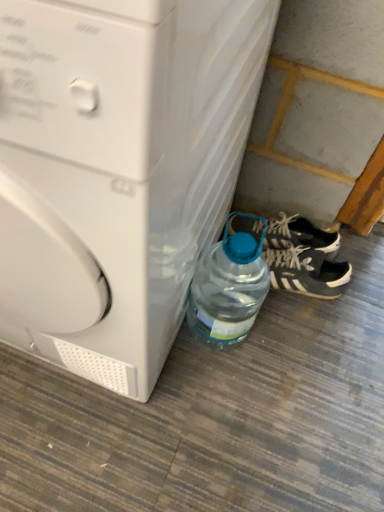
Question: Considering the relative positions of black suede sneakers at lower right and white plastic washing machine at lower left in the image provided, is black suede sneakers at lower right in front of white plastic washing machine at lower left?

Choices:
 (A) no
 (B) yes

Answer: (A)

Question: Is black suede sneakers at lower right not within white plastic washing machine at lower left?

Choices:
 (A) no
 (B) yes

Answer: (B)

Question: Would you say black suede sneakers at lower right contains white plastic washing machine at lower left?

Choices:
 (A) yes
 (B) no

Answer: (B)

Question: From the image's perspective, is black suede sneakers at lower right located beneath white plastic washing machine at lower left?

Choices:
 (A) no
 (B) yes

Answer: (B)

Question: Does black suede sneakers at lower right have a larger size compared to white plastic washing machine at lower left?

Choices:
 (A) no
 (B) yes

Answer: (A)

Question: Is black suede sneakers at lower right shorter than white plastic washing machine at lower left?

Choices:
 (A) no
 (B) yes

Answer: (B)

Question: Considering the relative sizes of transparent plastic bottle at lower right and black matte sneakers at lower right in the image provided, is transparent plastic bottle at lower right smaller than black matte sneakers at lower right?

Choices:
 (A) yes
 (B) no

Answer: (B)

Question: Is transparent plastic bottle at lower right at the left side of black matte sneakers at lower right?

Choices:
 (A) yes
 (B) no

Answer: (A)

Question: Considering the relative sizes of transparent plastic bottle at lower right and black matte sneakers at lower right in the image provided, is transparent plastic bottle at lower right wider than black matte sneakers at lower right?

Choices:
 (A) yes
 (B) no

Answer: (B)

Question: Is transparent plastic bottle at lower right aimed at black matte sneakers at lower right?

Choices:
 (A) no
 (B) yes

Answer: (A)

Question: Is transparent plastic bottle at lower right turned away from black matte sneakers at lower right?

Choices:
 (A) no
 (B) yes

Answer: (B)

Question: Considering the relative sizes of transparent plastic bottle at lower right and black matte sneakers at lower right in the image provided, is transparent plastic bottle at lower right shorter than black matte sneakers at lower right?

Choices:
 (A) no
 (B) yes

Answer: (A)

Question: Is transparent plastic bottle at lower right aimed at white plastic washing machine at lower left?

Choices:
 (A) no
 (B) yes

Answer: (A)